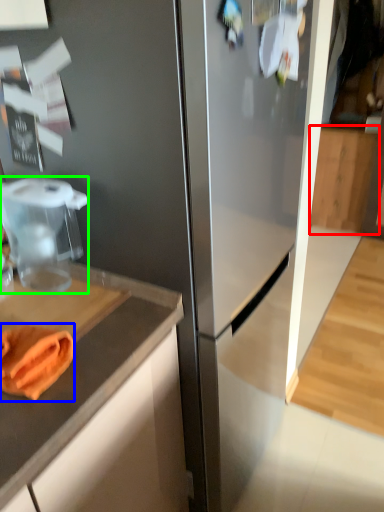
Question: Based on their relative distances, which object is nearer to cabinetry (highlighted by a red box)? Choose from food (highlighted by a blue box) and food processor (highlighted by a green box).

Choices:
 (A) food
 (B) food processor

Answer: (B)